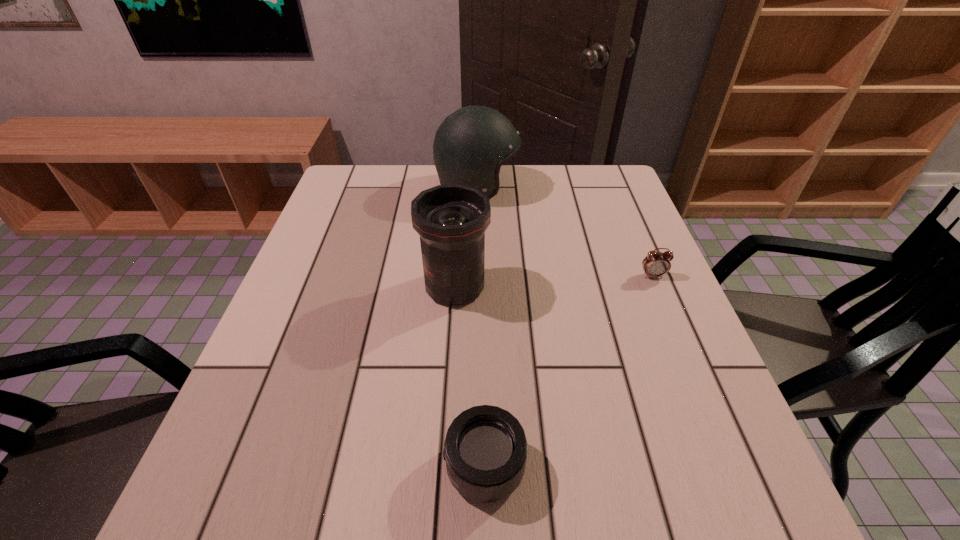
Locate an element on the screen. vacant position located 0.160m on the side of the shorter telephoto lens with brand markings and control switches is located at coordinates (344, 467).

At what (x,y) coordinates should I click in order to perform the action: click on object present at the far edge. Please return your answer as a coordinate pair (x, y). Image resolution: width=960 pixels, height=540 pixels. Looking at the image, I should click on (470, 146).

The width and height of the screenshot is (960, 540). Find the location of `object that is at the near edge`. object that is at the near edge is located at coordinates (485, 449).

Image resolution: width=960 pixels, height=540 pixels. I want to click on object that is at the right edge, so click(656, 264).

In order to click on vacant position at the far edge of the desktop in this screenshot , I will do `click(541, 174)`.

This screenshot has width=960, height=540. Identify the location of vacant space at the near edge of the desktop. pyautogui.click(x=416, y=478).

Identify the location of vacant space at the left edge of the desktop. This screenshot has height=540, width=960. (323, 210).

Where is `vacant space at the right edge`? The width and height of the screenshot is (960, 540). vacant space at the right edge is located at coordinates (636, 302).

At what (x,y) coordinates should I click in order to perform the action: click on free spot at the far right corner of the desktop. Please return your answer as a coordinate pair (x, y). Image resolution: width=960 pixels, height=540 pixels. Looking at the image, I should click on (614, 178).

In the image, there is a desktop. Identify the location of vacant space at the near right corner. (731, 509).